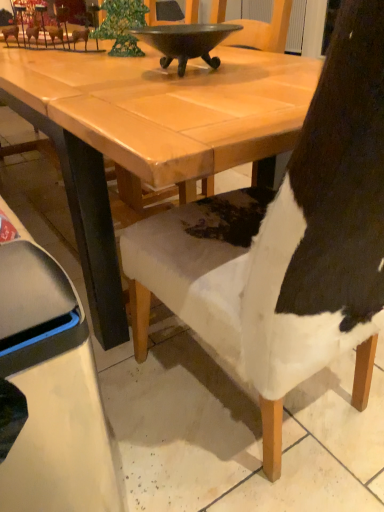
This screenshot has height=512, width=384. What are the coordinates of `spots to the right of shiny dark metal bowl at upper center` in the screenshot? It's located at (269, 70).